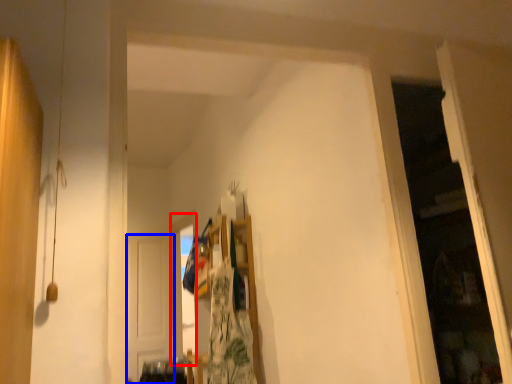
Question: Which object appears farthest to the camera in this image, window (highlighted by a red box) or door (highlighted by a blue box)?

Choices:
 (A) window
 (B) door

Answer: (B)